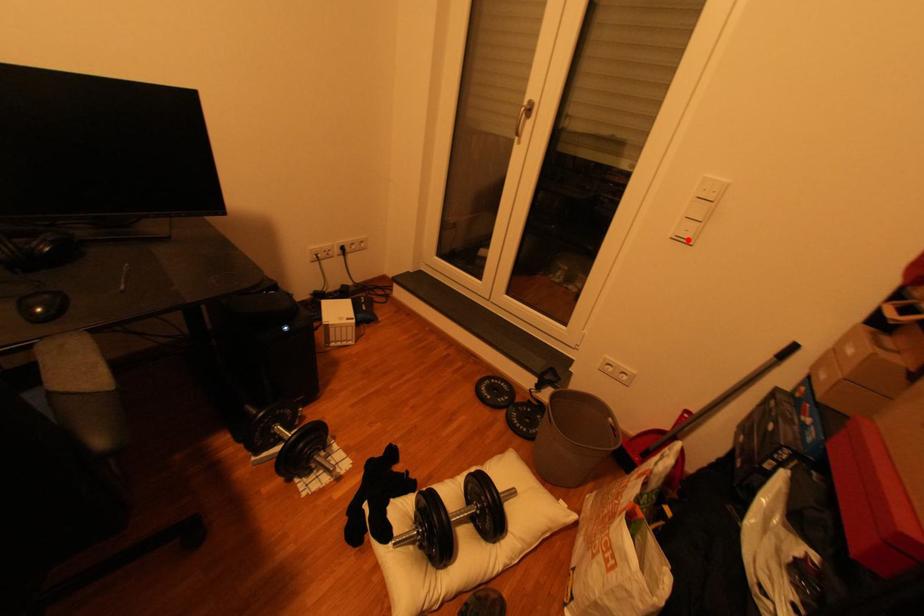
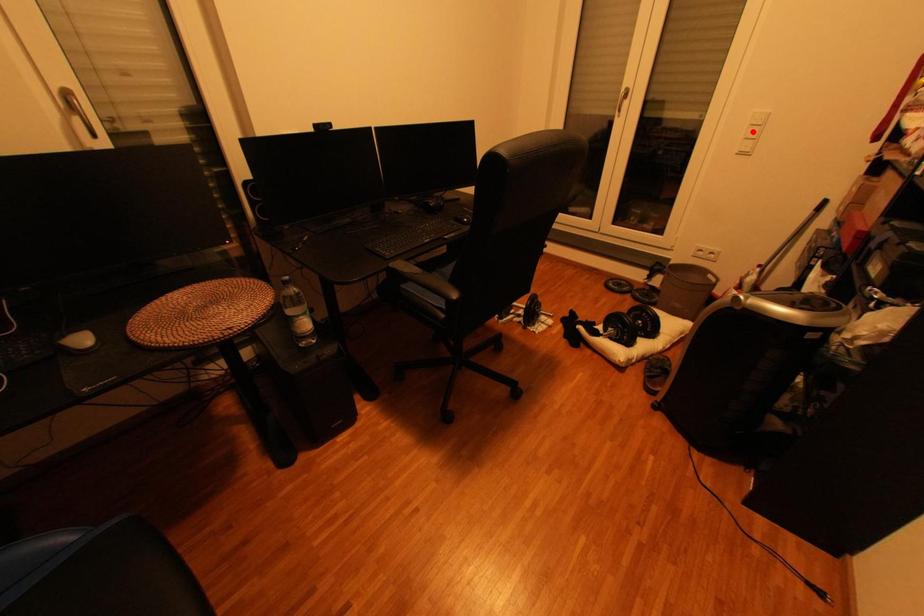
I am providing you with two images of the same scene from different viewpoints. A red point is marked on the first image and another point is marked on the second image. Is the marked point in image1 the same physical position as the marked point in image2?

No